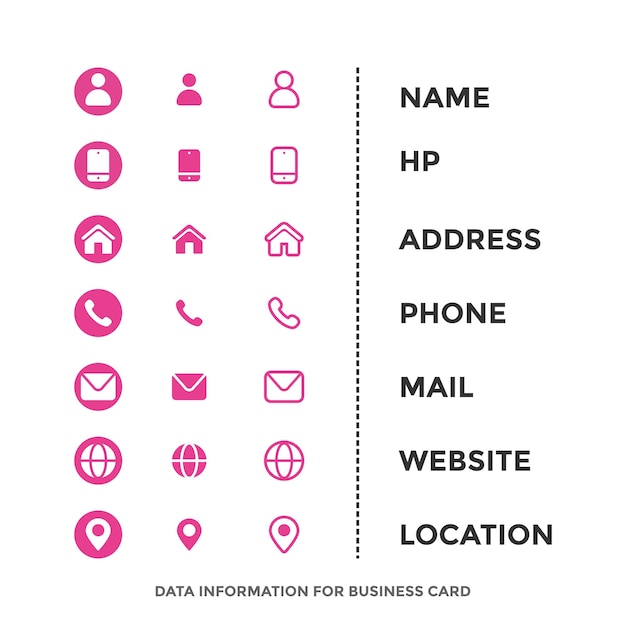
Locate an element on the screen. phone is located at coordinates (426, 319), (280, 316), (183, 313), (105, 317).